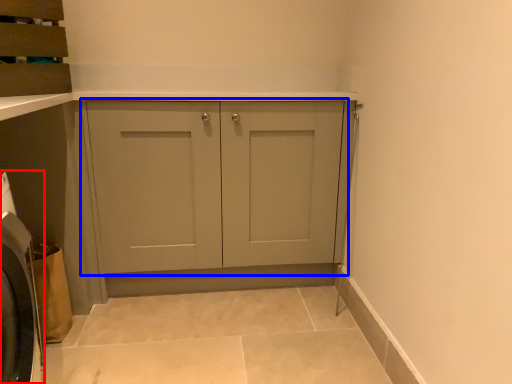
Question: Among these objects, which one is nearest to the camera, washing machine (highlighted by a red box) or cupboard (highlighted by a blue box)?

Choices:
 (A) washing machine
 (B) cupboard

Answer: (A)